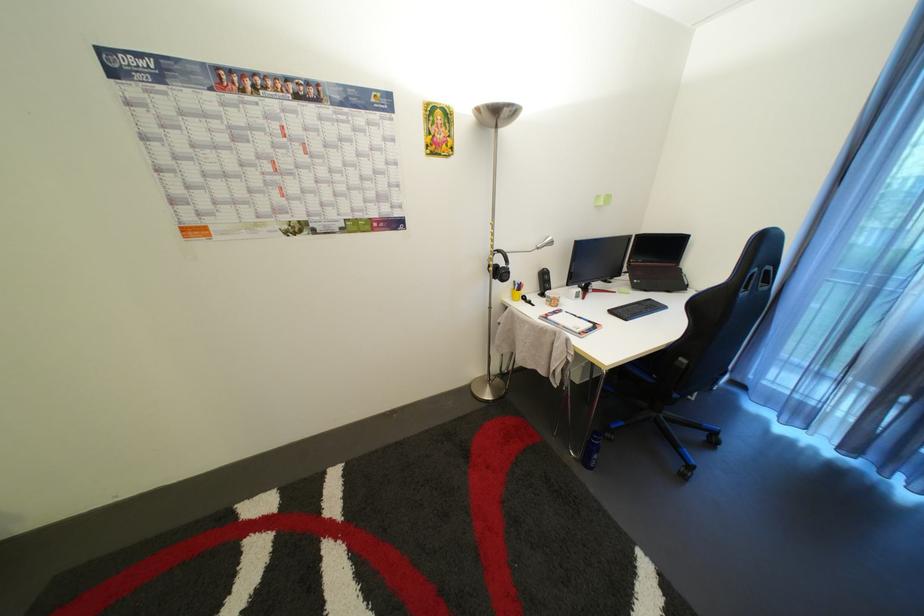
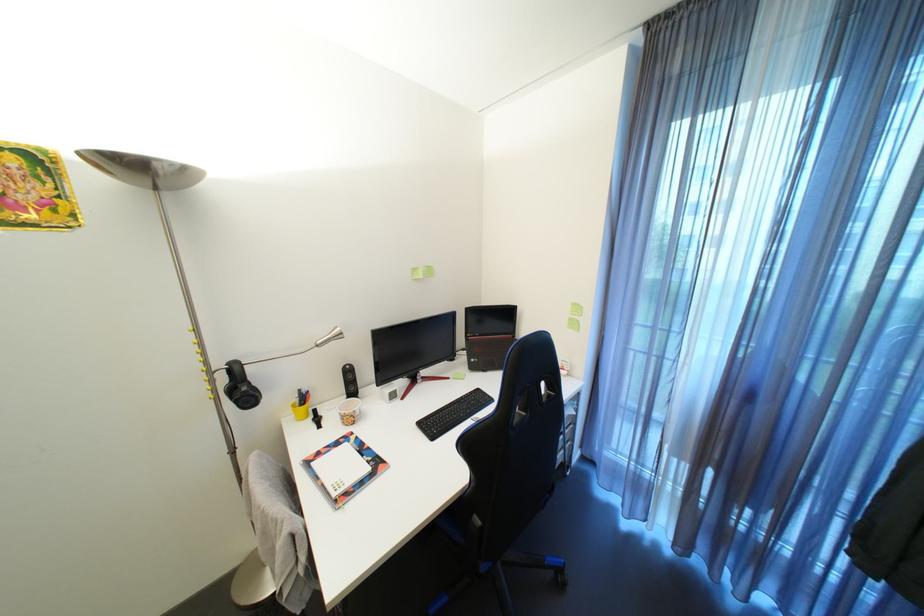
Question: How did the camera likely rotate?

Choices:
 (A) Left
 (B) Right
 (C) Up
 (D) Down

Answer: (B)